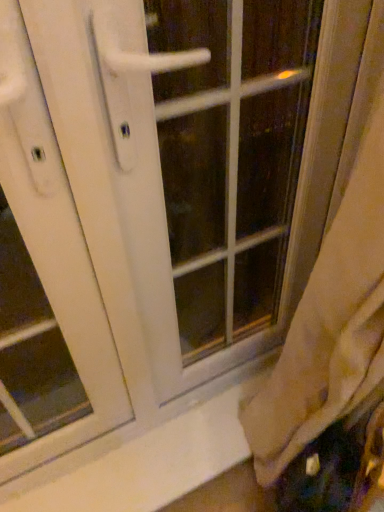
Where is `blank space above white smooth window sill at lower center (from a real-world perspective)`? The width and height of the screenshot is (384, 512). blank space above white smooth window sill at lower center (from a real-world perspective) is located at coordinates (164, 459).